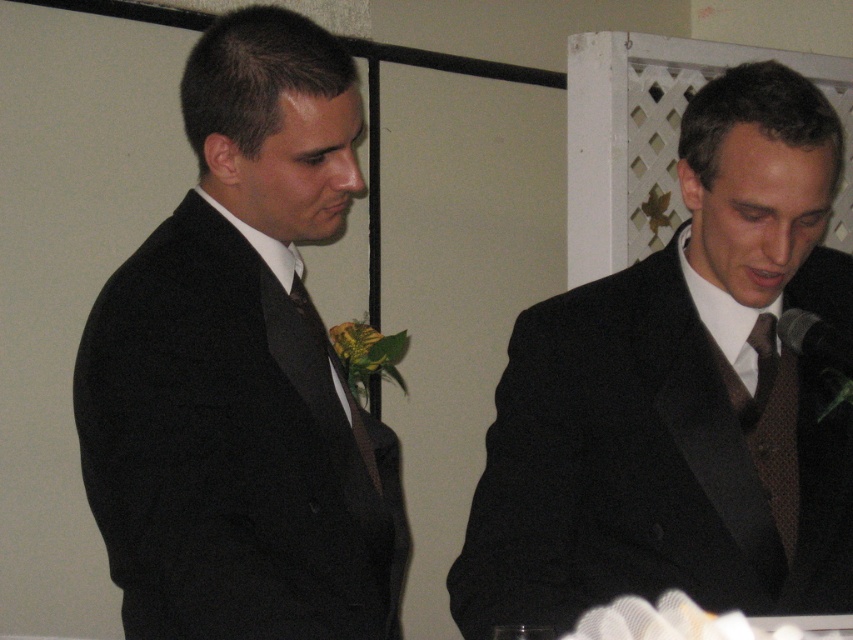
Who is positioned more to the left, brown dotted tie at right or black textured microphone at right?

From the viewer's perspective, brown dotted tie at right appears more on the left side.

Is brown dotted tie at right to the right of black textured microphone at right from the viewer's perspective?

In fact, brown dotted tie at right is to the left of black textured microphone at right.

What do you see at coordinates (775, 428) in the screenshot? I see `brown dotted tie at right` at bounding box center [775, 428].

What are the coordinates of `brown dotted tie at right` in the screenshot? It's located at (775, 428).

Is matte black suit at left to the left of brown dotted tie at right from the viewer's perspective?

Indeed, matte black suit at left is positioned on the left side of brown dotted tie at right.

Is matte black suit at left thinner than brown dotted tie at right?

In fact, matte black suit at left might be wider than brown dotted tie at right.

The height and width of the screenshot is (640, 853). What are the coordinates of `matte black suit at left` in the screenshot? It's located at (242, 371).

Is black textured suit at center wider than black textured microphone at right?

Correct, the width of black textured suit at center exceeds that of black textured microphone at right.

Is black textured suit at center smaller than black textured microphone at right?

No, black textured suit at center is not smaller than black textured microphone at right.

Which is in front, point (535, 412) or point (787, 317)?

Positioned in front is point (787, 317).

Locate an element on the screen. This screenshot has height=640, width=853. black textured suit at center is located at coordinates (682, 396).